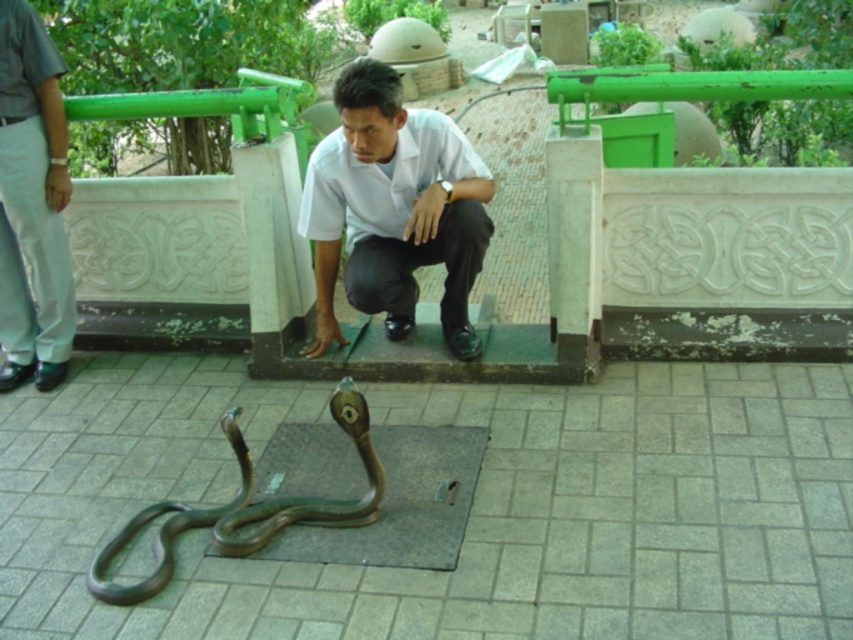
You are a fashion designer observing the outdoor scene. You need to determine if the distance between the white smooth shirt at center and the gray cotton pants at left is sufficient to place a 3.5 feet wide accessory between them. Can you confirm if there is enough space?

The distance between the white smooth shirt at center and the gray cotton pants at left is 4.28 feet, which is wider than the 3.5 feet wide accessory. Therefore, there is enough space to place the accessory between them.

Based on the photo, you are standing in the outdoor area with the paved herringbone brick ground. You see a cobra in defensive posture and a point marked on the image. What object is located at the point marked as (393, 209)?

The point marked as (393, 209) indicates the white smooth shirt at center.

You are a photographer taking a picture of the gray cotton pants at left and the shiny bronze snake at lower center. Which object will appear bigger in the photo?

The gray cotton pants at left will appear bigger in the photo because it has a larger size compared to the shiny bronze snake at lower center.